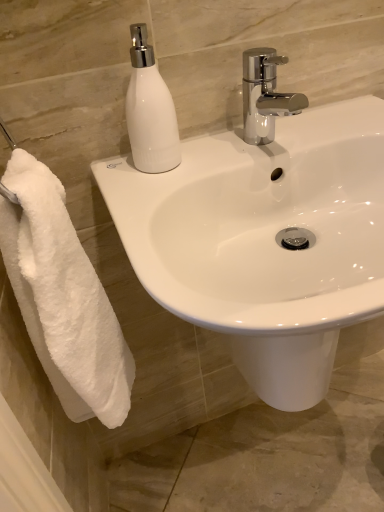
I want to click on vacant area that is situated to the right of chrome metallic faucet at upper center, so click(x=329, y=125).